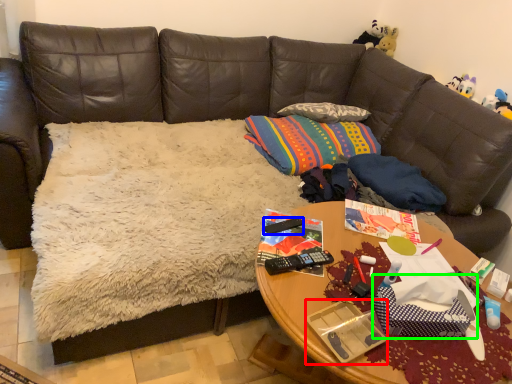
Question: Based on their relative distances, which object is nearer to package (highlighted by a red box)? Choose from remote control (highlighted by a blue box) and gift bag (highlighted by a green box).

Choices:
 (A) remote control
 (B) gift bag

Answer: (B)